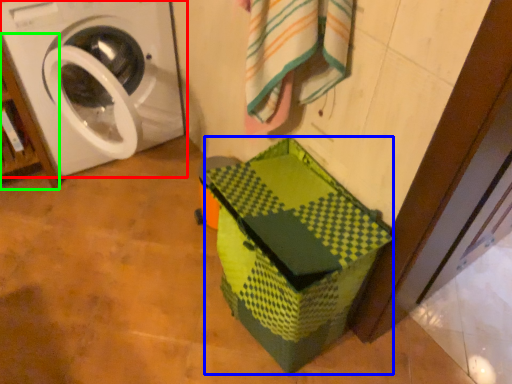
Question: Which object is the farthest from washing machine (highlighted by a red box)? Choose among these: cardboard box (highlighted by a blue box) or shelf (highlighted by a green box).

Choices:
 (A) cardboard box
 (B) shelf

Answer: (A)